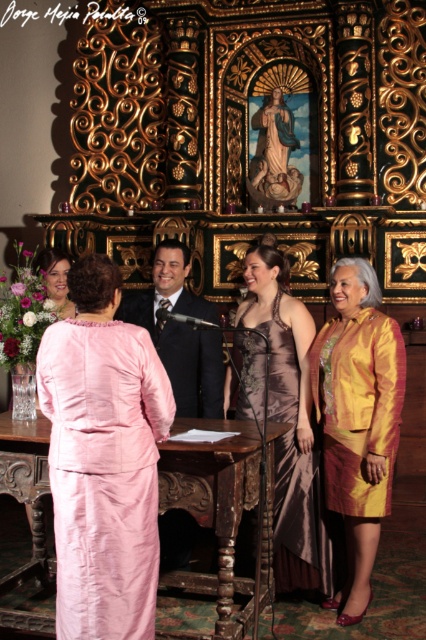
Who is positioned more to the left, gold silk skirt at right or matte pink dress at lower left?

From the viewer's perspective, matte pink dress at lower left appears more on the left side.

Between gold silk skirt at right and matte pink dress at lower left, which one has less height?

matte pink dress at lower left

Is point (325, 371) closer to camera compared to point (40, 259)?

Yes.

Where is `gold silk skirt at right`? The height and width of the screenshot is (640, 426). gold silk skirt at right is located at coordinates (357, 419).

Is pink silk dress at center to the right of pink satin dress at lower left from the viewer's perspective?

Incorrect, pink silk dress at center is not on the right side of pink satin dress at lower left.

How much distance is there between pink silk dress at center and pink satin dress at lower left?

pink silk dress at center and pink satin dress at lower left are 39.28 inches apart.

In order to click on pink silk dress at center in this screenshot , I will do `click(103, 460)`.

In the scene shown: Which is below, matte pink altar at center or shiny black suit at center?

matte pink altar at center

The width and height of the screenshot is (426, 640). Describe the element at coordinates (213, 509) in the screenshot. I see `matte pink altar at center` at that location.

The height and width of the screenshot is (640, 426). I want to click on matte pink altar at center, so pos(213,509).

Find the location of a particular element. matte pink altar at center is located at coordinates (213, 509).